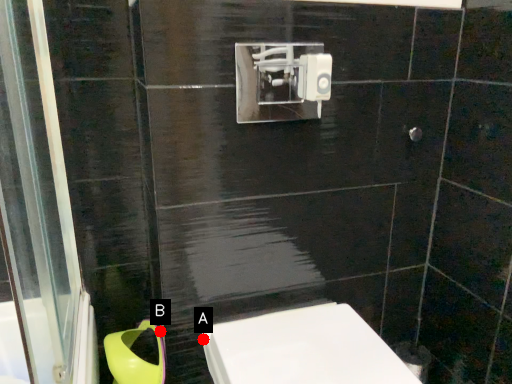
Question: Two points are circled on the image, labeled by A and B beside each circle. Which point is farther from the camera taking this photo?

Choices:
 (A) A is further
 (B) B is further

Answer: (B)